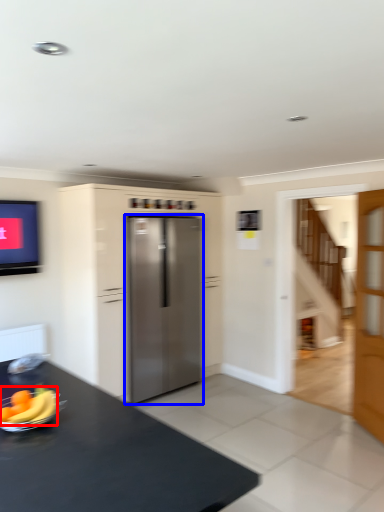
Question: Which of the following is the farthest to the observer, banana (highlighted by a red box) or refrigerator (highlighted by a blue box)?

Choices:
 (A) banana
 (B) refrigerator

Answer: (B)